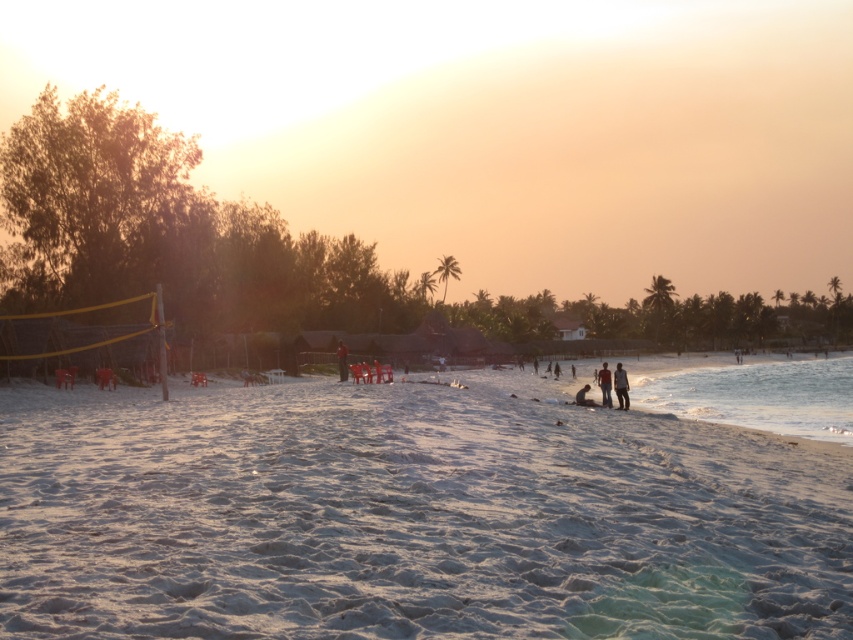
Question: From the image, what is the correct spatial relationship of light brown wooden surfboard at center in relation to blurred human figure at center?

Choices:
 (A) above
 (B) below

Answer: (B)

Question: Which point appears closest to the camera in this image?

Choices:
 (A) (346, 372)
 (B) (608, 401)

Answer: (B)

Question: Which is nearer to the blurred human figure at center?

Choices:
 (A) white sandy beach at center
 (B) red fabric person at center
 (C) light brown wooden surfboard at center

Answer: (C)

Question: Estimate the real-world distances between objects in this image. Which object is farther from the light brown wooden surfboard at center?

Choices:
 (A) white sandy beach at center
 (B) red fabric person at center

Answer: (A)

Question: Where is blurred human figure at center located in relation to red fabric person at center in the image?

Choices:
 (A) right
 (B) left

Answer: (A)

Question: Can you confirm if white sandy beach at center is wider than light brown wooden surfboard at center?

Choices:
 (A) no
 (B) yes

Answer: (B)